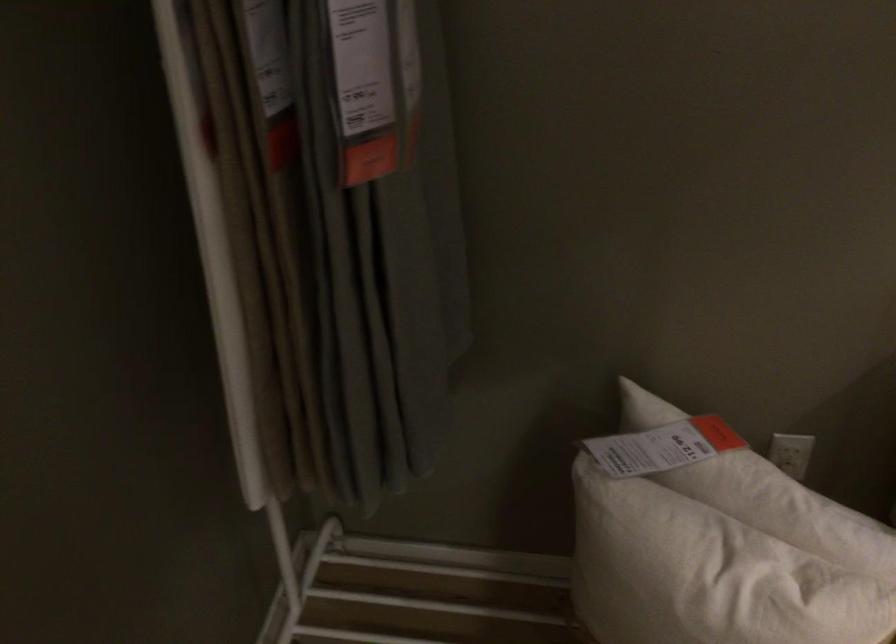
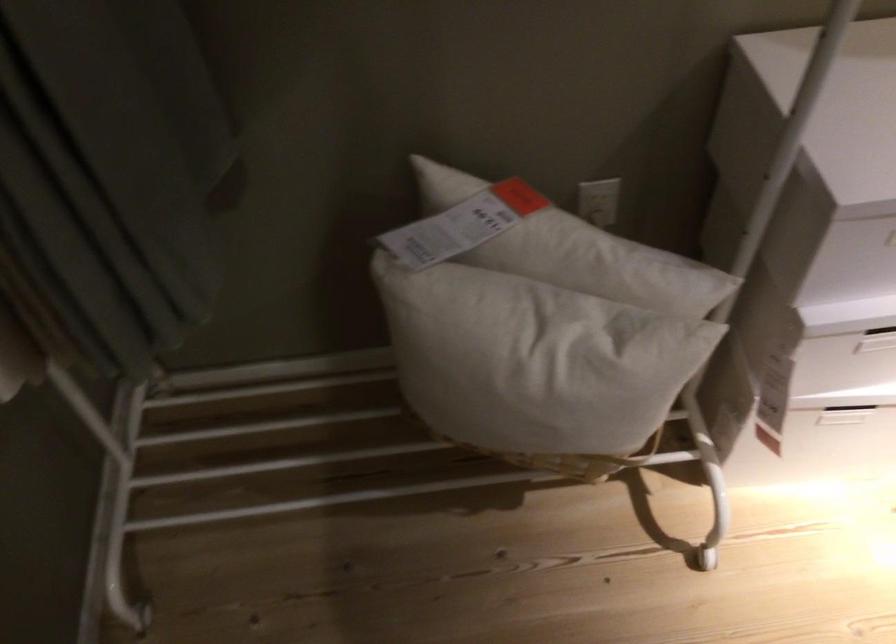
Question: The images are taken continuously from a first-person perspective. In which direction is your viewpoint rotating?

Choices:
 (A) Left
 (B) Right
 (C) Up
 (D) Down

Answer: (D)